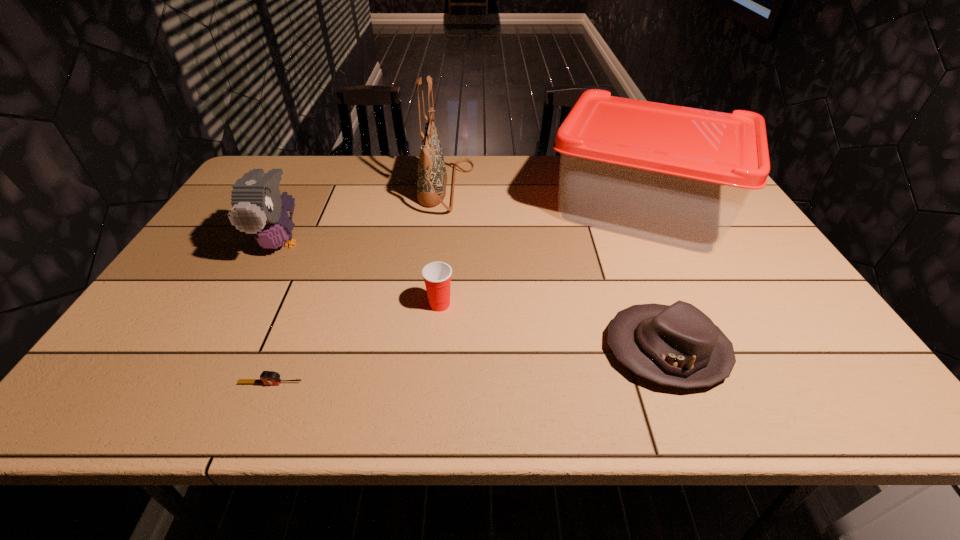
You are a GUI agent. You are given a task and a screenshot of the screen. Output one action in this format:
    pyautogui.click(x=<x>, y=<y>)
    Task: Click on the object at the right edge
    The height and width of the screenshot is (540, 960).
    Given the screenshot: What is the action you would take?
    pyautogui.click(x=676, y=175)

The image size is (960, 540). Identify the location of object located at the far right corner. (676, 175).

In the image, there is a desktop. Where is `vacant space at the far edge`? This screenshot has width=960, height=540. vacant space at the far edge is located at coordinates (468, 166).

Image resolution: width=960 pixels, height=540 pixels. I want to click on vacant space at the left edge of the desktop, so 235,264.

You are a GUI agent. You are given a task and a screenshot of the screen. Output one action in this format:
    pyautogui.click(x=<x>, y=<y>)
    Task: Click on the free space at the right edge
    This screenshot has width=960, height=540.
    Given the screenshot: What is the action you would take?
    pyautogui.click(x=829, y=333)

This screenshot has height=540, width=960. Identify the location of vacant area that lies between the handbag and the tray. (542, 198).

Where is `free space between the bird and the hat`? Image resolution: width=960 pixels, height=540 pixels. free space between the bird and the hat is located at coordinates (474, 296).

Identify the location of vacant area that lies between the shortest object and the handbag. This screenshot has width=960, height=540. (358, 286).

Locate an element on the screen. The image size is (960, 540). vacant region between the hat and the Dixie cup is located at coordinates (553, 327).

Locate an element on the screen. This screenshot has height=540, width=960. free space between the tallest object and the Dixie cup is located at coordinates (443, 246).